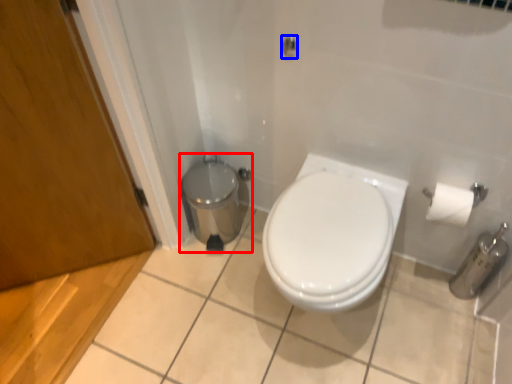
Question: Which object is closer to the camera taking this photo, porcelain (highlighted by a red box) or shower (highlighted by a blue box)?

Choices:
 (A) porcelain
 (B) shower

Answer: (B)